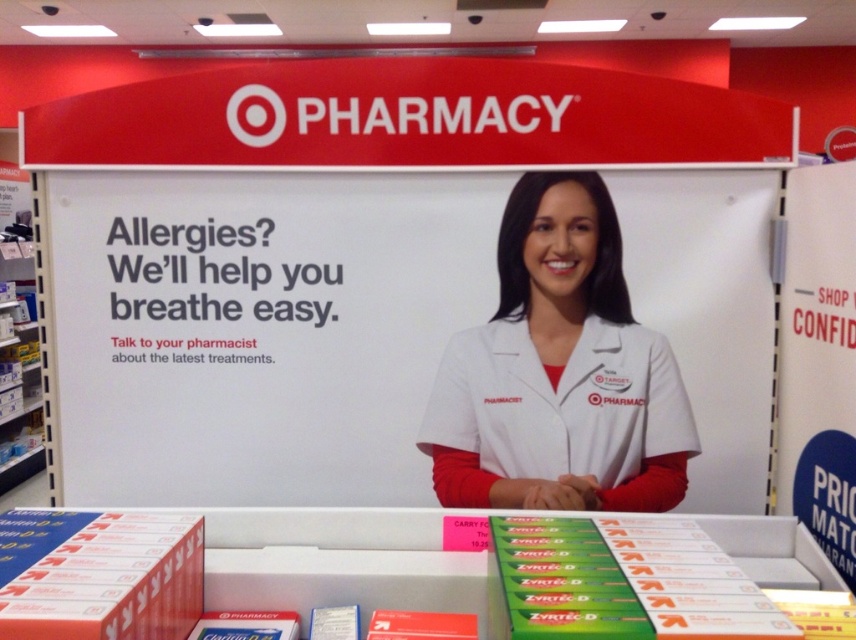
You are a customer at the Target Pharmacy counter. You notice two points on the pharmacy sign. The first point is at coordinates point (123,289) and the second point is at point (502,316). Which point is closer to you?

Point (123,289) is further to the camera than point (502,316), so the point closer to you is point (502,316).

You are a customer standing in front of the pharmacy counter. You need to hand a prescription to the pharmacist. Which object should you approach first, the white paperboard at center or the white smooth coat at center?

You should approach the white smooth coat at center first because the white paperboard at center is further away from you than the white smooth coat at center.

You are standing at the pharmacy counter in the Target Pharmacy section. You need to reach a point marked at coordinates point (710, 381). If your arm length is 0.6 meters, can you reach the point without moving your feet?

The point (710, 381) is 1.49 meters away from the camera. Since your arm length is only 0.6 meters, you cannot reach the point without moving your feet.